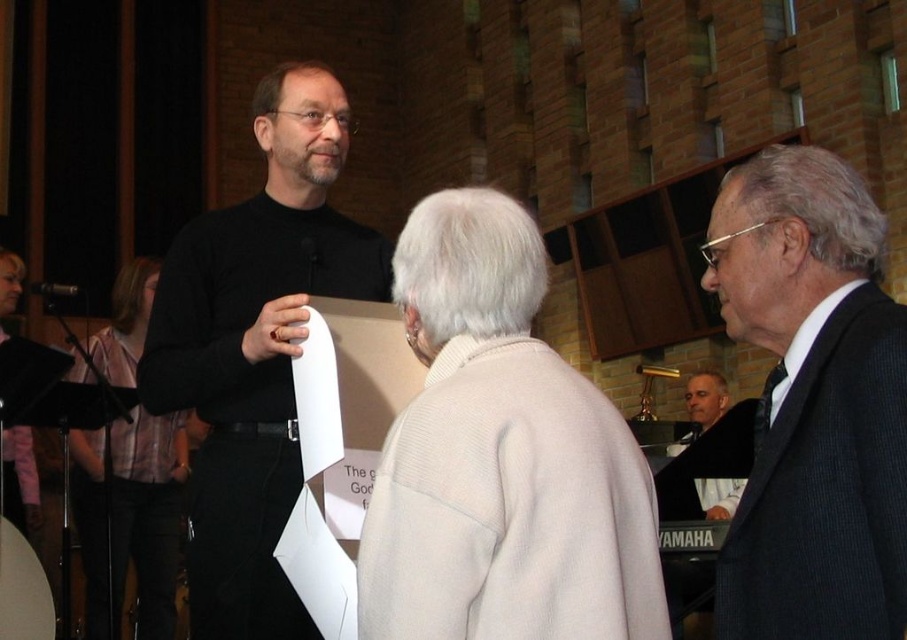
Question: Considering the real-world distances, which object is closest to the white woolen sweater at center?

Choices:
 (A) black matte sweater at center
 (B) dark gray suit at right
 (C) plaid shirt at left
 (D) gray hair at center

Answer: (B)

Question: Is dark gray suit at right wider than plaid shirt at left?

Choices:
 (A) yes
 (B) no

Answer: (B)

Question: Does plaid shirt at left have a lesser width compared to gray hair at center?

Choices:
 (A) no
 (B) yes

Answer: (A)

Question: Which point is closer to the camera?

Choices:
 (A) (680, 448)
 (B) (194, 348)

Answer: (B)

Question: Does white woolen sweater at center come in front of black matte sweater at center?

Choices:
 (A) yes
 (B) no

Answer: (A)

Question: Which point is farther to the camera?

Choices:
 (A) (272, 438)
 (B) (120, 349)
 (C) (533, 515)

Answer: (B)